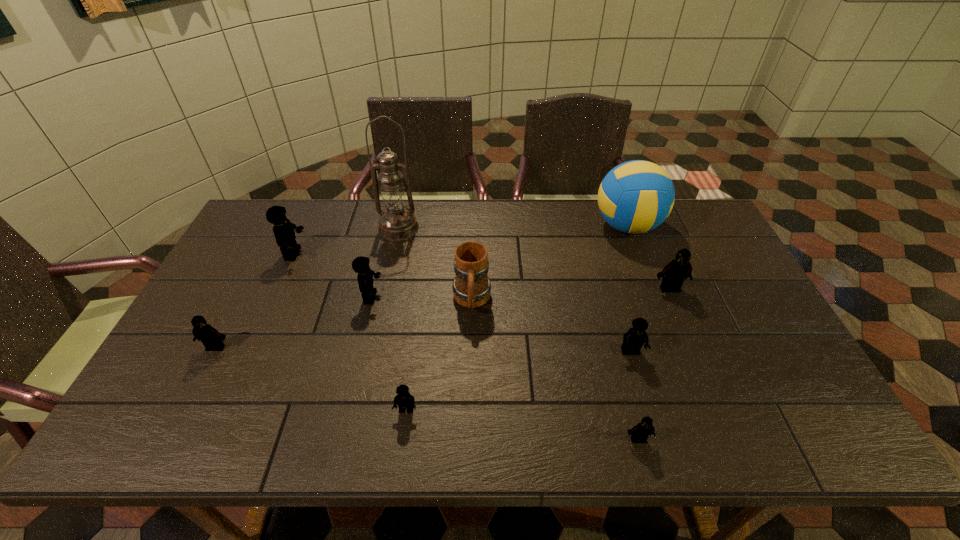
What are the coordinates of `the leftmost object` in the screenshot? It's located at (211, 338).

Locate an element on the screen. The image size is (960, 540). the second smallest black Lego is located at coordinates (211, 338).

What are the coordinates of `the rightmost yellow Lego` in the screenshot? It's located at (633, 340).

Where is `the second smallest yellow Lego`? The width and height of the screenshot is (960, 540). the second smallest yellow Lego is located at coordinates (633, 340).

Locate an element on the screen. The height and width of the screenshot is (540, 960). the sixth farthest Lego is located at coordinates [405, 401].

Find the location of a particular element. The width and height of the screenshot is (960, 540). the third yellow Lego from left to right is located at coordinates (405, 401).

Image resolution: width=960 pixels, height=540 pixels. I want to click on the nearest object, so click(x=641, y=432).

Where is `the second black Lego from left to right`? The image size is (960, 540). the second black Lego from left to right is located at coordinates (641, 432).

This screenshot has width=960, height=540. In order to click on vacant space situated 0.070m on the front of the oil lamp in this screenshot , I will do point(393,255).

Where is `free space located on the front of the blue volleyball`? The height and width of the screenshot is (540, 960). free space located on the front of the blue volleyball is located at coordinates (661, 318).